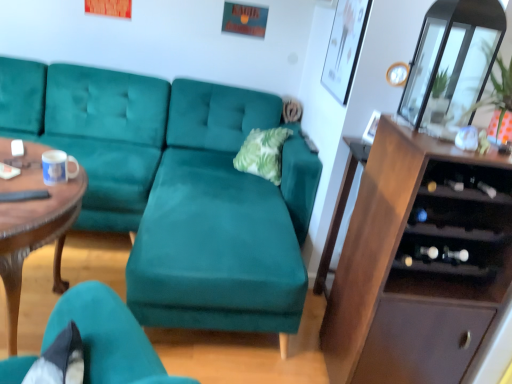
Question: In the image, is transparent glass door at upper right on the left side or the right side of white glossy mug at center?

Choices:
 (A) right
 (B) left

Answer: (A)

Question: Is point (440, 64) positioned closer to the camera than point (64, 162)?

Choices:
 (A) farther
 (B) closer

Answer: (B)

Question: Which object is the farthest from the white glossy mug at center?

Choices:
 (A) brown wood cabinet at right
 (B) transparent glass door at upper right
 (C) wooden polished coffee table at left
 (D) teal velvet couch at center

Answer: (B)

Question: Which object is the farthest from the brown wood cabinet at right?

Choices:
 (A) teal velvet couch at center
 (B) white glossy mug at center
 (C) transparent glass door at upper right
 (D) wooden polished coffee table at left

Answer: (B)